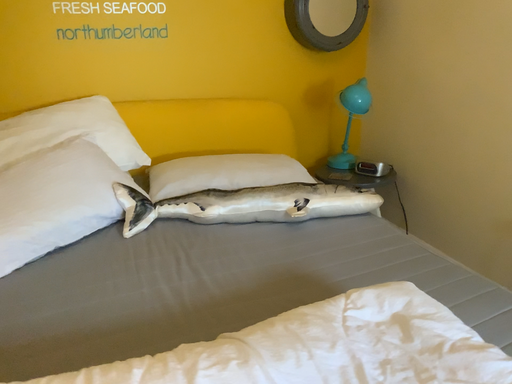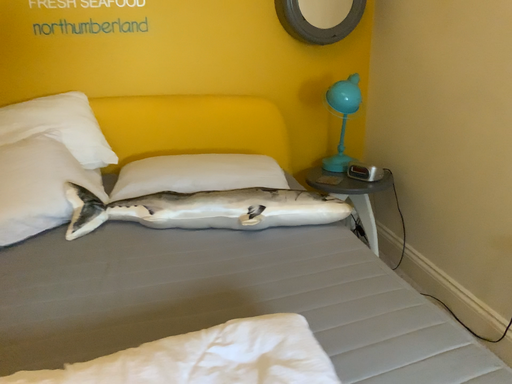
Question: How did the camera likely rotate when shooting the video?

Choices:
 (A) rotated right
 (B) rotated left

Answer: (B)